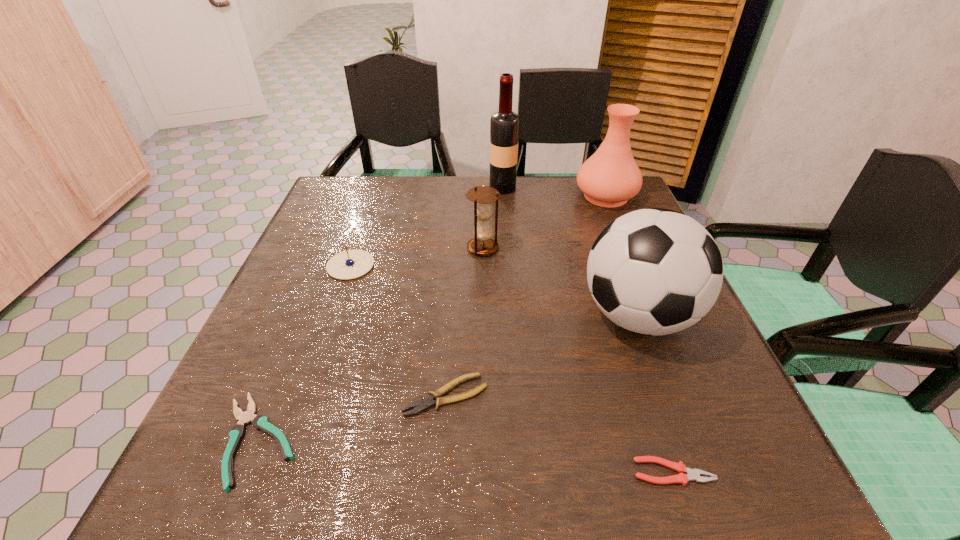
Where is `wine bottle`? This screenshot has height=540, width=960. wine bottle is located at coordinates (504, 124).

You are a GUI agent. You are given a task and a screenshot of the screen. Output one action in this format:
    pyautogui.click(x=<x>, y=<y>)
    Task: Click on the vase
    
    Given the screenshot: What is the action you would take?
    pyautogui.click(x=610, y=177)

This screenshot has width=960, height=540. In order to click on soccer ball in this screenshot , I will do `click(654, 271)`.

At what (x,y) coordinates should I click in order to perform the action: click on the fifth shortest object. Please return your answer as a coordinate pair (x, y). This screenshot has width=960, height=540. Looking at the image, I should click on (482, 244).

Find the location of a particular element. This screenshot has height=540, width=960. compass is located at coordinates (350, 264).

Image resolution: width=960 pixels, height=540 pixels. What are the coordinates of `the second pliers from right to left` in the screenshot? It's located at (423, 404).

At what (x,y) coordinates should I click in order to perform the action: click on the rightmost pliers. Please return your answer as a coordinate pair (x, y). This screenshot has width=960, height=540. Looking at the image, I should click on (694, 474).

Where is `the leftmost pliers`? The height and width of the screenshot is (540, 960). the leftmost pliers is located at coordinates (260, 422).

Find the location of a particular element. The width and height of the screenshot is (960, 540). vacant space located on the left of the wine bottle is located at coordinates (451, 188).

Image resolution: width=960 pixels, height=540 pixels. I want to click on free point located 0.100m on the front of the vase, so click(x=622, y=235).